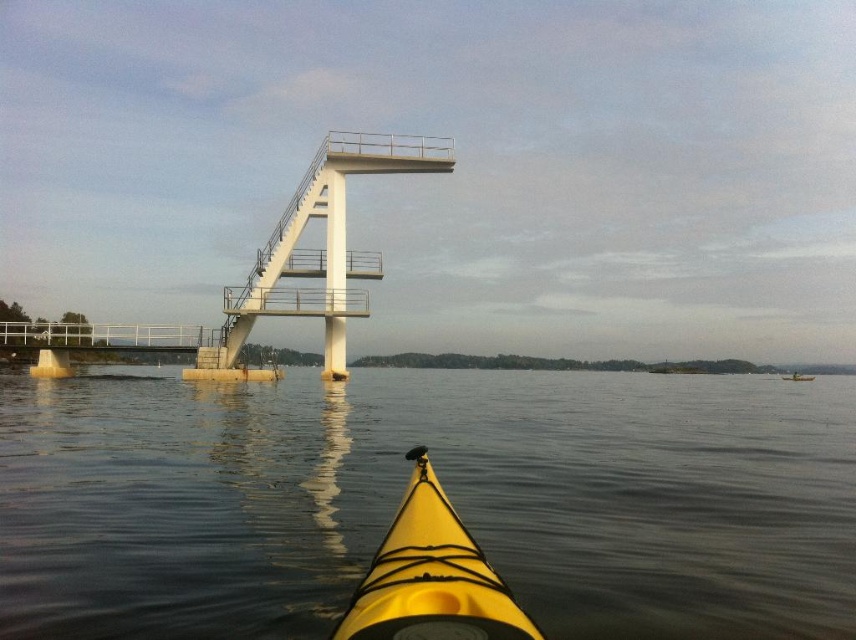
Does yellow rubber kayak at center have a smaller size compared to white metallic bridge at center?

Incorrect, yellow rubber kayak at center is not smaller in size than white metallic bridge at center.

Which of these two, yellow rubber kayak at center or white metallic bridge at center, stands shorter?

Standing shorter between the two is yellow rubber kayak at center.

Does point (268, 438) lie behind point (348, 147)?

No.

Where is `yellow rubber kayak at center`? yellow rubber kayak at center is located at coordinates (446, 492).

Is point (372, 161) positioned after point (418, 554)?

Yes, it is.

This screenshot has height=640, width=856. What do you see at coordinates (317, 252) in the screenshot?
I see `white metallic bridge at center` at bounding box center [317, 252].

Image resolution: width=856 pixels, height=640 pixels. I want to click on white metallic bridge at center, so coord(317,252).

Is yellow rubber kayak at center taller than yellow matte kayak at lower center?

Yes, yellow rubber kayak at center is taller than yellow matte kayak at lower center.

Is point (159, 577) in front of point (334, 630)?

No, it is behind (334, 630).

This screenshot has width=856, height=640. I want to click on yellow rubber kayak at center, so pos(446,492).